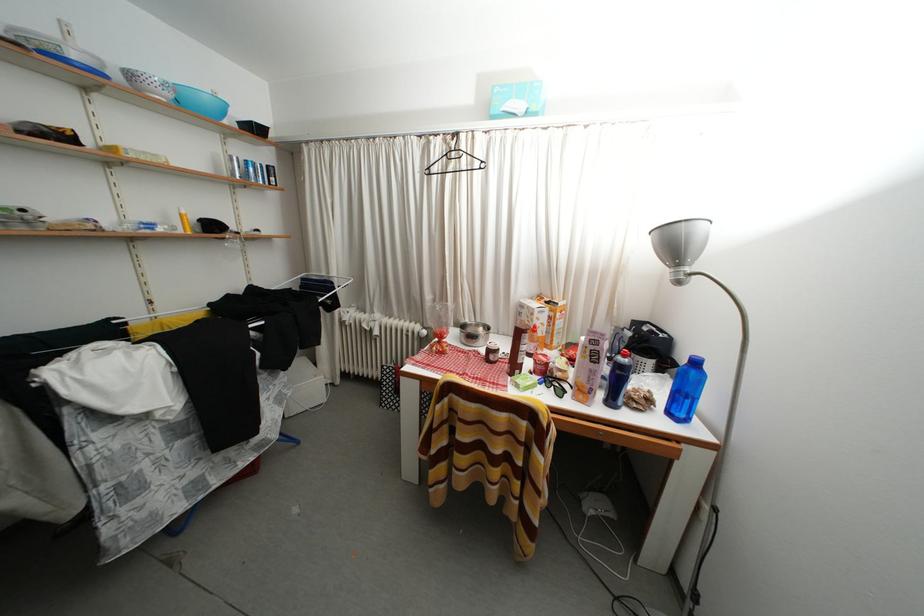
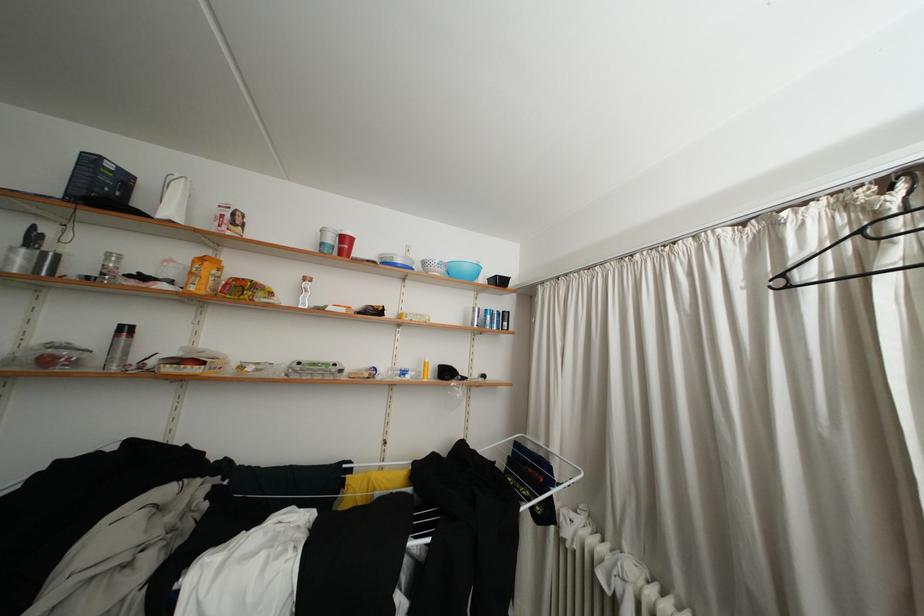
The point at (460,160) is marked in the first image. Where is the corresponding point in the second image?

(906, 229)